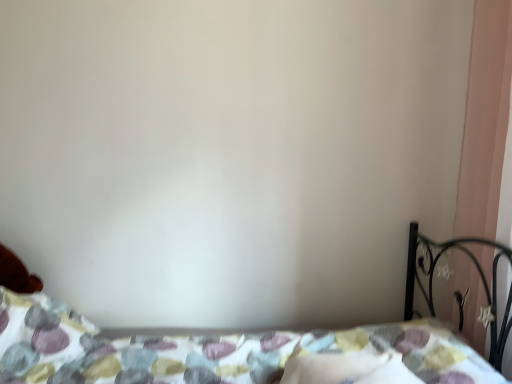
Question: From the image's perspective, relative to white soft pillow at lower center, is patterned fabric bed at lower center above or below?

Choices:
 (A) above
 (B) below

Answer: (B)

Question: Choose the correct answer: Is patterned fabric bed at lower center inside white soft pillow at lower center or outside it?

Choices:
 (A) inside
 (B) outside

Answer: (B)

Question: Based on their relative distances, which object is farther from the patterned fabric bed at lower center?

Choices:
 (A) white soft pillow at lower center
 (B) pink matte curtain at right

Answer: (B)

Question: Considering the real-world distances, which object is closest to the white soft pillow at lower center?

Choices:
 (A) patterned fabric bed at lower center
 (B) pink matte curtain at right

Answer: (A)